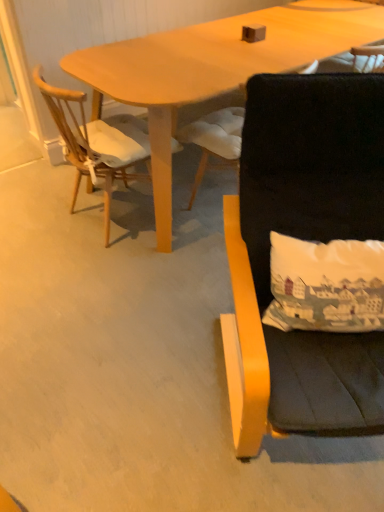
Question: Looking at the image, does wooden chair at left, marked as the 1th chair in a left-to-right arrangement, seem bigger or smaller compared to black fabric chair at right, which ranks as the first chair in right-to-left order?

Choices:
 (A) small
 (B) big

Answer: (A)

Question: From a real-world perspective, is wooden chair at left, marked as the 1th chair in a left-to-right arrangement, positioned above or below black fabric chair at right, which ranks as the first chair in right-to-left order?

Choices:
 (A) above
 (B) below

Answer: (B)

Question: Estimate the real-world distances between objects in this image. Which object is farther from the black fabric chair at right, which ranks as the 3th chair in left-to-right order?

Choices:
 (A) black fabric chair at center, which ranks as the 2th chair in left-to-right order
 (B) wooden chair at left, marked as the 1th chair in a left-to-right arrangement

Answer: (B)

Question: Which object is the farthest from the black fabric chair at center, which is the second chair in right-to-left order?

Choices:
 (A) black fabric chair at right, which ranks as the first chair in right-to-left order
 (B) wooden chair at left, which is counted as the third chair, starting from the right

Answer: (A)